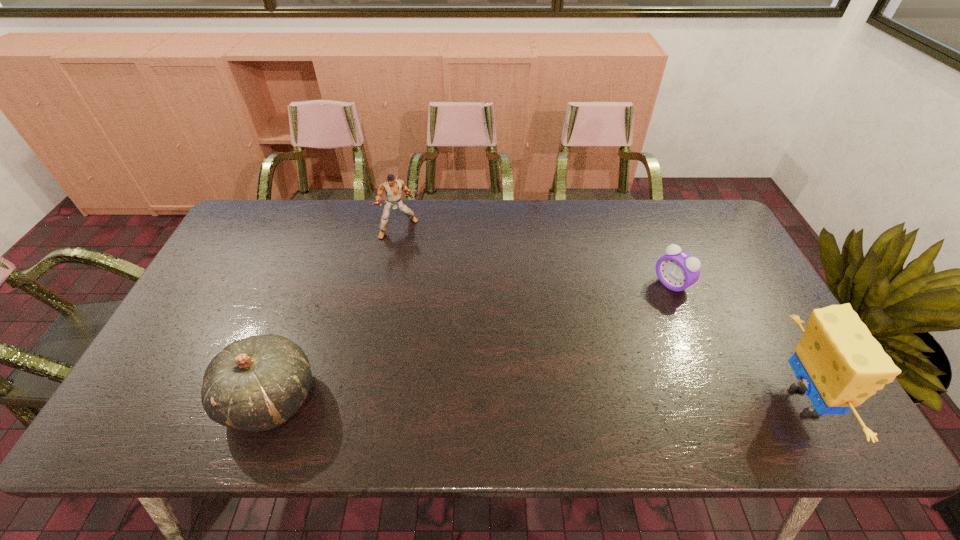
I want to click on the leftmost object, so click(257, 383).

You are a GUI agent. You are given a task and a screenshot of the screen. Output one action in this format:
    pyautogui.click(x=<x>, y=<y>)
    Task: Click on the gourd
    
    Given the screenshot: What is the action you would take?
    pyautogui.click(x=257, y=383)

This screenshot has width=960, height=540. I want to click on the rightmost object, so click(x=841, y=364).

Identify the location of the tallest object. (841, 364).

Identify the location of the third object from left to right. pyautogui.click(x=677, y=270).

Where is `the third nearest object`? Image resolution: width=960 pixels, height=540 pixels. the third nearest object is located at coordinates (677, 270).

The height and width of the screenshot is (540, 960). Find the location of `puncher`. puncher is located at coordinates (392, 188).

You are a GUI agent. You are given a task and a screenshot of the screen. Output one action in this format:
    pyautogui.click(x=<x>, y=<y>)
    Task: Click on the farthest object
    
    Given the screenshot: What is the action you would take?
    point(392,188)

Find the location of `free point located 0.050m on the left of the third tallest object`. free point located 0.050m on the left of the third tallest object is located at coordinates (200, 399).

Identify the location of free spot located 0.240m on the face of the third nearest object. (600, 329).